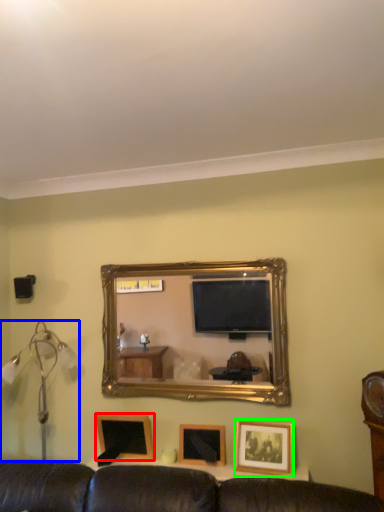
Question: Which object is the closest to the picture frame (highlighted by a red box)? Choose among these: table lamp (highlighted by a blue box) or picture frame (highlighted by a green box).

Choices:
 (A) table lamp
 (B) picture frame

Answer: (A)